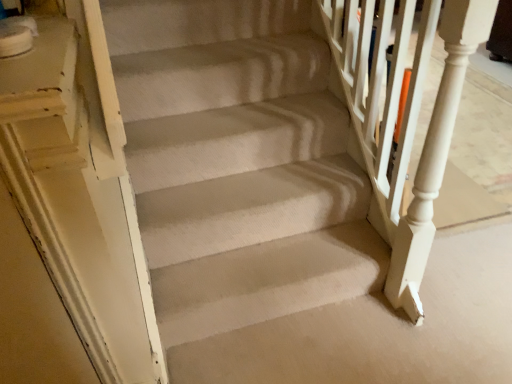
What are the coordinates of `white textured rail at upper right` in the screenshot? It's located at (404, 118).

The width and height of the screenshot is (512, 384). What do you see at coordinates (404, 118) in the screenshot?
I see `white textured rail at upper right` at bounding box center [404, 118].

Image resolution: width=512 pixels, height=384 pixels. Identify the location of beige carpeted stairs at center. (380, 330).

This screenshot has height=384, width=512. Describe the element at coordinates (380, 330) in the screenshot. I see `beige carpeted stairs at center` at that location.

The height and width of the screenshot is (384, 512). Find the location of `white textured rail at upper right`. white textured rail at upper right is located at coordinates (404, 118).

Considering the relative positions of white textured rail at upper right and beige carpeted stairs at center in the image provided, is white textured rail at upper right to the left of beige carpeted stairs at center from the viewer's perspective?

No, white textured rail at upper right is not to the left of beige carpeted stairs at center.

Relative to beige carpeted stairs at center, is white textured rail at upper right in front or behind?

Visually, white textured rail at upper right is located in front of beige carpeted stairs at center.

Is point (407, 216) behind point (196, 367)?

No.

From the image's perspective, which is above, white textured rail at upper right or beige carpeted stairs at center?

From the image's view, white textured rail at upper right is above.

From a real-world perspective, is white textured rail at upper right above or below beige carpeted stairs at center?

From a real-world perspective, white textured rail at upper right is physically above beige carpeted stairs at center.

Can you confirm if white textured rail at upper right is thinner than beige carpeted stairs at center?

Correct, the width of white textured rail at upper right is less than that of beige carpeted stairs at center.

Who is taller, white textured rail at upper right or beige carpeted stairs at center?

With more height is white textured rail at upper right.

Which of these two, white textured rail at upper right or beige carpeted stairs at center, is smaller?

beige carpeted stairs at center is smaller.

Do you think white textured rail at upper right is within beige carpeted stairs at center, or outside of it?

white textured rail at upper right is not inside beige carpeted stairs at center, it's outside.

Looking at this image, would you say white textured rail at upper right is a long distance from beige carpeted stairs at center?

white textured rail at upper right is actually quite close to beige carpeted stairs at center.

Does white textured rail at upper right turn towards beige carpeted stairs at center?

Yes, white textured rail at upper right is turned towards beige carpeted stairs at center.

How different are the orientations of white textured rail at upper right and beige carpeted stairs at center in degrees?

They differ by 89.8 degrees in their facing directions.

Locate an element on the screen. This screenshot has height=384, width=512. rail located above the beige carpeted stairs at center (from a real-world perspective) is located at coordinates (404, 118).

Does beige carpeted stairs at center appear on the left side of white textured rail at upper right?

Correct, you'll find beige carpeted stairs at center to the left of white textured rail at upper right.

Which object is further away from the camera, beige carpeted stairs at center or white textured rail at upper right?

beige carpeted stairs at center is more distant.

Is point (272, 348) closer to camera compared to point (398, 295)?

Yes, it is in front of point (398, 295).

Looking at this image, from the image's perspective, is beige carpeted stairs at center positioned above or below white textured rail at upper right?

beige carpeted stairs at center is situated lower than white textured rail at upper right in the image.

From a real-world perspective, between beige carpeted stairs at center and white textured rail at upper right, who is vertically higher?

white textured rail at upper right.

Considering the relative sizes of beige carpeted stairs at center and white textured rail at upper right in the image provided, is beige carpeted stairs at center wider than white textured rail at upper right?

Yes, beige carpeted stairs at center is wider than white textured rail at upper right.

Based on the photo, which of these two, beige carpeted stairs at center or white textured rail at upper right, stands shorter?

Standing shorter between the two is beige carpeted stairs at center.

Between beige carpeted stairs at center and white textured rail at upper right, which one has smaller size?

beige carpeted stairs at center is smaller.

Is beige carpeted stairs at center positioned beyond the bounds of white textured rail at upper right?

Yes, beige carpeted stairs at center is outside of white textured rail at upper right.

Are beige carpeted stairs at center and white textured rail at upper right making contact?

No, beige carpeted stairs at center is not beside white textured rail at upper right.

Is beige carpeted stairs at center positioned with its back to white textured rail at upper right?

No, beige carpeted stairs at center is not facing away from white textured rail at upper right.

Can you tell me how much beige carpeted stairs at center and white textured rail at upper right differ in facing direction?

There is a 89.8-degree angle between the facing directions of beige carpeted stairs at center and white textured rail at upper right.

How far apart are beige carpeted stairs at center and white textured rail at upper right?

They are 18.51 inches apart.

Find the location of a particular element. The image size is (512, 384). concrete below the white textured rail at upper right (from a real-world perspective) is located at coordinates (380, 330).

Where is `rail lying above the beige carpeted stairs at center (from the image's perspective)`? The height and width of the screenshot is (384, 512). rail lying above the beige carpeted stairs at center (from the image's perspective) is located at coordinates (404, 118).

Locate an element on the screen. concrete that is behind the white textured rail at upper right is located at coordinates (380, 330).